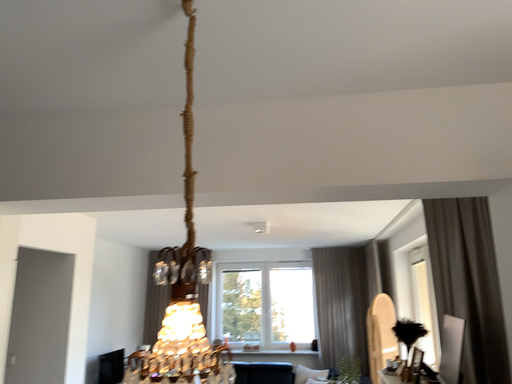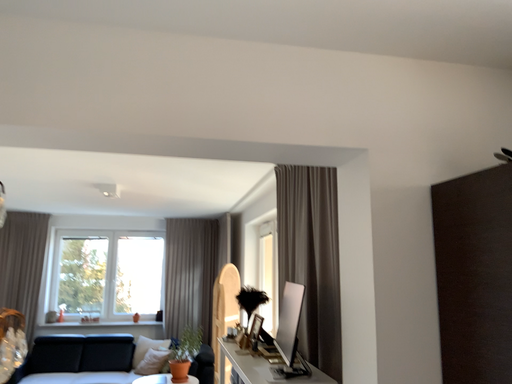
Question: How did the camera likely rotate when shooting the video?

Choices:
 (A) rotated left
 (B) rotated right

Answer: (B)